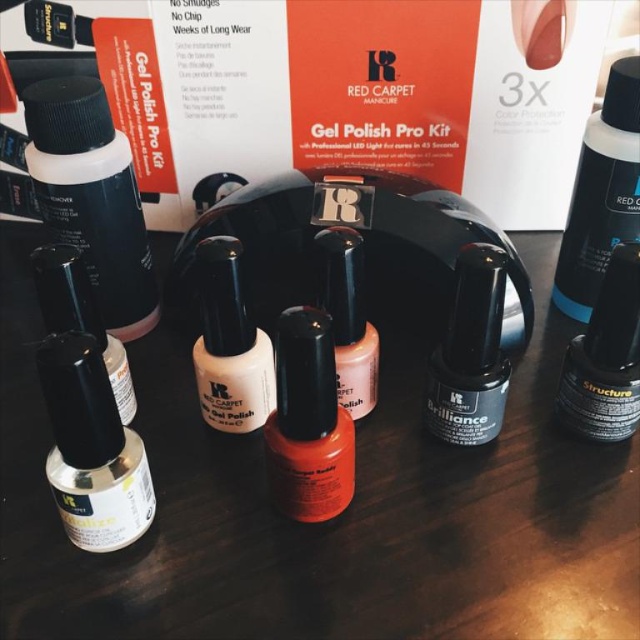
Question: Which object is positioned farthest from the black matte bottle at upper left?

Choices:
 (A) matte black bottle at upper right
 (B) black matte nail polish at center

Answer: (A)

Question: Is black matte nail polish at center positioned in front of matte white gel polish at center?

Choices:
 (A) no
 (B) yes

Answer: (B)

Question: Among these objects, which one is farthest from the camera?

Choices:
 (A) matte white nail polish at left
 (B) matte black nail polish at lower left

Answer: (B)

Question: Which point is closer to the camera taking this photo?

Choices:
 (A) (112, 342)
 (B) (358, 305)
 (C) (596, 262)

Answer: (B)

Question: Is matte black bottle at upper right bigger than matte white gel polish at center?

Choices:
 (A) no
 (B) yes

Answer: (B)

Question: Where is matte white nail polish at left located in relation to matte black structure at center in the image?

Choices:
 (A) right
 (B) left

Answer: (B)